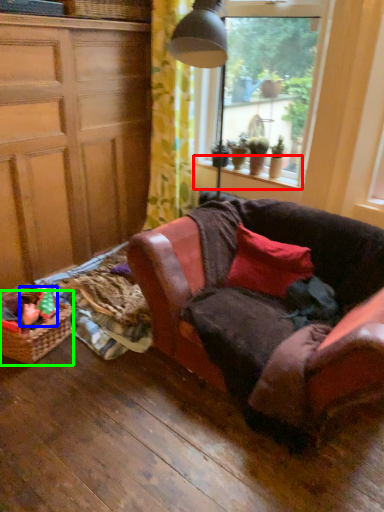
Question: Estimate the real-world distances between objects in this image. Which object is closer to window sill (highlighted by a red box), toy (highlighted by a blue box) or picnic basket (highlighted by a green box)?

Choices:
 (A) toy
 (B) picnic basket

Answer: (A)